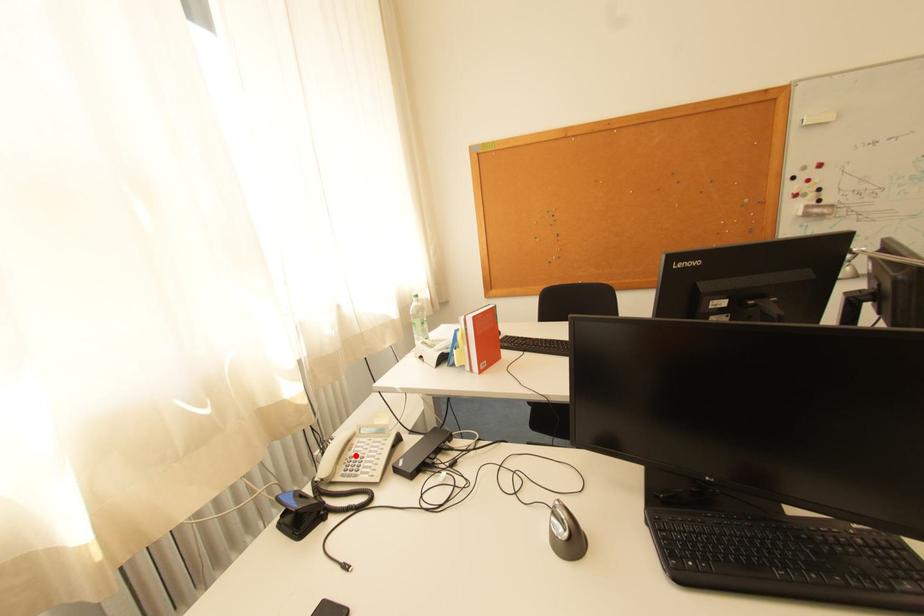
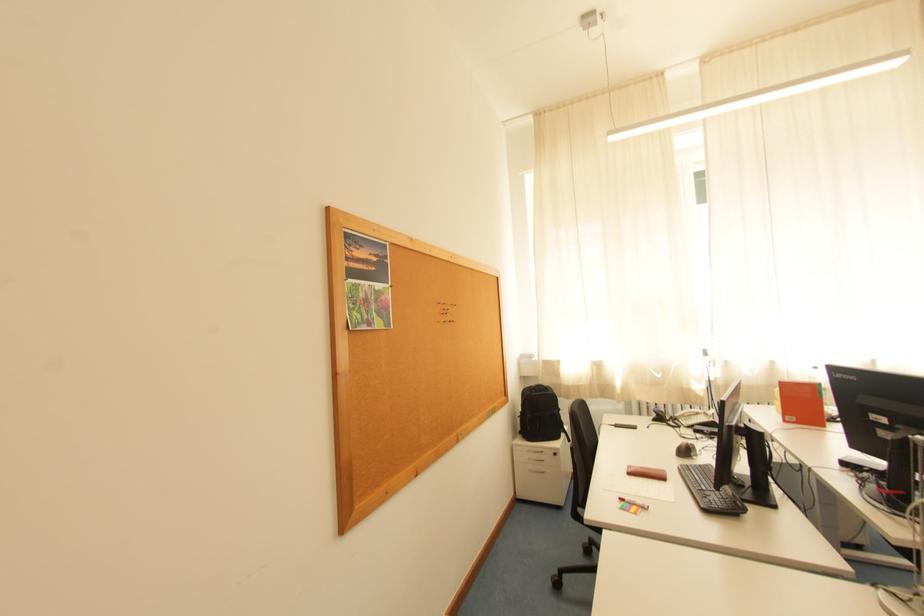
In the second image, find the point that corresponds to the highlighted location in the first image.

(699, 418)